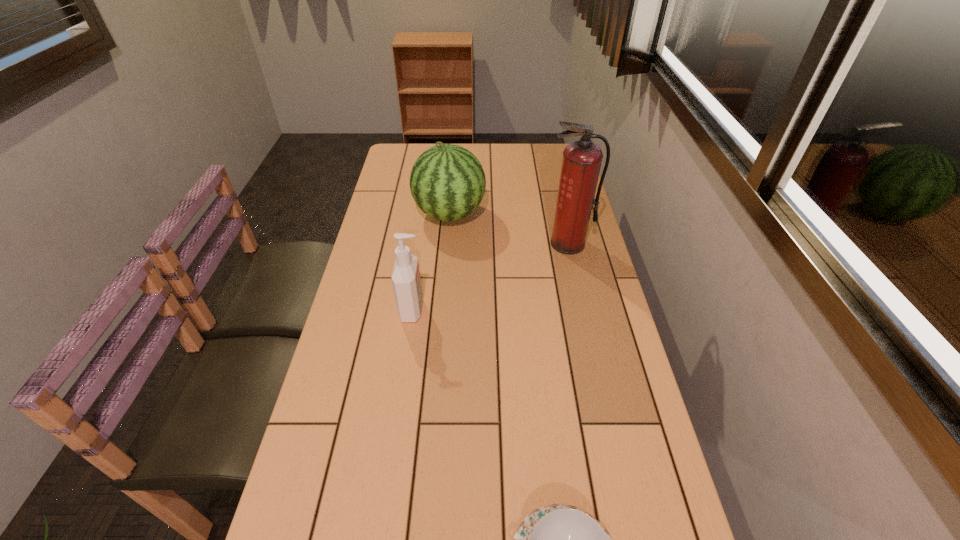
You are a GUI agent. You are given a task and a screenshot of the screen. Output one action in this format:
    pyautogui.click(x=<x>, y=<y>)
    Task: Click on the vacant point that satisfies the following two spatial constraints: 1. at the nozzle of the fire extinguisher; 2. on the front label of the second nearest object
    
    Given the screenshot: What is the action you would take?
    (583, 309)

Locate an element on the screen. free space that satisfies the following two spatial constraints: 1. at the nozzle of the fire extinguisher; 2. on the front label of the third farthest object is located at coordinates (583, 309).

Identify the location of vacant space that satisfies the following two spatial constraints: 1. at the nozzle of the fire extinguisher; 2. on the front label of the second nearest object. (583, 309).

The image size is (960, 540). Find the location of `free space that satisfies the following two spatial constraints: 1. at the nozzle of the tallest object; 2. on the front label of the cleansing agent`. free space that satisfies the following two spatial constraints: 1. at the nozzle of the tallest object; 2. on the front label of the cleansing agent is located at coordinates (583, 309).